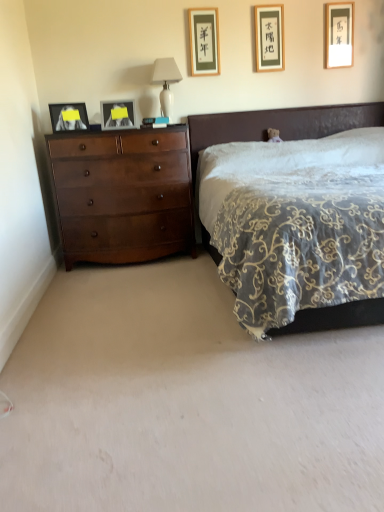
Question: Considering the relative sizes of matte black picture frame at upper center, which is the second picture frame from left to right, and matte gold picture frame at upper right, acting as the 5th picture frame starting from the left, in the image provided, is matte black picture frame at upper center, which is the second picture frame from left to right, smaller than matte gold picture frame at upper right, acting as the 5th picture frame starting from the left,?

Choices:
 (A) no
 (B) yes

Answer: (A)

Question: Can you confirm if matte black picture frame at upper center, which is the second picture frame from left to right, is thinner than matte gold picture frame at upper right, acting as the 5th picture frame starting from the left?

Choices:
 (A) yes
 (B) no

Answer: (B)

Question: Is the position of matte black picture frame at upper center, which is the second picture frame from left to right, less distant than that of matte gold picture frame at upper right, acting as the 5th picture frame starting from the left?

Choices:
 (A) yes
 (B) no

Answer: (A)

Question: Is matte black picture frame at upper center, the 4th picture frame in the right-to-left sequence, at the right side of matte gold picture frame at upper right, which ranks as the first picture frame in right-to-left order?

Choices:
 (A) no
 (B) yes

Answer: (A)

Question: Can you confirm if matte black picture frame at upper center, the 4th picture frame in the right-to-left sequence, is bigger than matte gold picture frame at upper right, which ranks as the first picture frame in right-to-left order?

Choices:
 (A) no
 (B) yes

Answer: (B)

Question: Based on their positions, is matte wooden picture frame at upper center, placed as the fourth picture frame when sorted from left to right, located to the left or right of black paper picture frame at upper center, the third picture frame from the left?

Choices:
 (A) right
 (B) left

Answer: (A)

Question: From a real-world perspective, relative to black paper picture frame at upper center, the third picture frame from the left, is matte wooden picture frame at upper center, placed as the 2th picture frame when sorted from right to left, vertically above or below?

Choices:
 (A) below
 (B) above

Answer: (A)

Question: Is matte wooden picture frame at upper center, placed as the 2th picture frame when sorted from right to left, situated inside black paper picture frame at upper center, the third picture frame from the left, or outside?

Choices:
 (A) outside
 (B) inside

Answer: (A)

Question: Is matte wooden picture frame at upper center, placed as the fourth picture frame when sorted from left to right, in front of or behind black paper picture frame at upper center, the third picture frame from the left, in the image?

Choices:
 (A) front
 (B) behind

Answer: (B)

Question: From their relative heights in the image, would you say matte black picture frame at left, which appears as the 1th picture frame when viewed from the left, is taller or shorter than matte black picture frame at upper center, which is the second picture frame from left to right?

Choices:
 (A) short
 (B) tall

Answer: (A)

Question: In terms of size, does matte black picture frame at left, which appears as the 1th picture frame when viewed from the left, appear bigger or smaller than matte black picture frame at upper center, the 4th picture frame in the right-to-left sequence?

Choices:
 (A) small
 (B) big

Answer: (A)

Question: From a real-world perspective, relative to matte black picture frame at upper center, the 4th picture frame in the right-to-left sequence, is matte black picture frame at left, the 5th picture frame in the right-to-left sequence, vertically above or below?

Choices:
 (A) below
 (B) above

Answer: (A)

Question: Is point (61, 121) positioned closer to the camera than point (110, 121)?

Choices:
 (A) farther
 (B) closer

Answer: (A)

Question: Is black paper picture frame at upper center, the third picture frame from the left, inside or outside of matte gold picture frame at upper right, acting as the 5th picture frame starting from the left?

Choices:
 (A) outside
 (B) inside

Answer: (A)

Question: From a real-world perspective, is black paper picture frame at upper center, the 3th picture frame viewed from the right, positioned above or below matte gold picture frame at upper right, acting as the 5th picture frame starting from the left?

Choices:
 (A) above
 (B) below

Answer: (A)